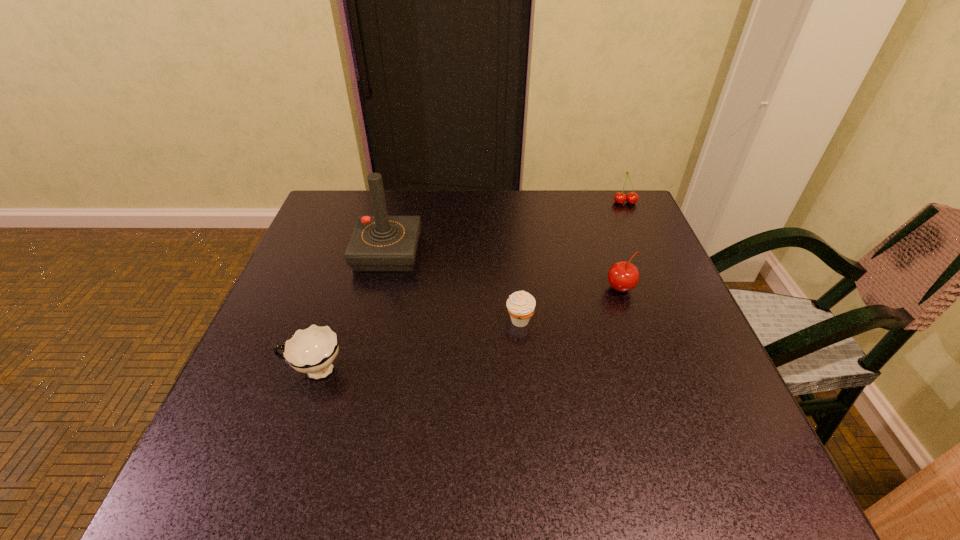
Where is `vacant area between the third nearest object and the joystick`? vacant area between the third nearest object and the joystick is located at coordinates (504, 271).

This screenshot has width=960, height=540. What are the coordinates of `free point between the third farthest object and the muffin` in the screenshot? It's located at (570, 305).

Find the location of a particular element. empty location between the cup and the rightmost object is located at coordinates (469, 287).

At what (x,y) coordinates should I click in order to perform the action: click on vacant area that lies between the fourth farthest object and the left cherry. Please return your answer as a coordinate pair (x, y). The height and width of the screenshot is (540, 960). Looking at the image, I should click on (570, 305).

Locate an element on the screen. free area in between the nearest object and the muffin is located at coordinates (417, 346).

The height and width of the screenshot is (540, 960). I want to click on free space between the third farthest object and the second nearest object, so click(x=570, y=305).

Locate which object ranks third in proximity to the muffin. Please provide its 2D coordinates. Your answer should be formatted as a tuple, i.e. [(x, y)], where the tuple contains the x and y coordinates of a point satisfying the conditions above.

[(312, 350)]

Locate an element on the screen. The height and width of the screenshot is (540, 960). object that can be found as the closest to the second farthest object is located at coordinates (312, 350).

Image resolution: width=960 pixels, height=540 pixels. Identify the location of free location that satisfies the following two spatial constraints: 1. on the rectangular base of the nearer cherry; 2. on the right side of the fourth nearest object. (379, 288).

At what (x,y) coordinates should I click in order to perform the action: click on vacant space that satisfies the following two spatial constraints: 1. on the side of the left cherry with the handle; 2. on the right side of the nearest object. Please return your answer as a coordinate pair (x, y). This screenshot has width=960, height=540. Looking at the image, I should click on (342, 288).